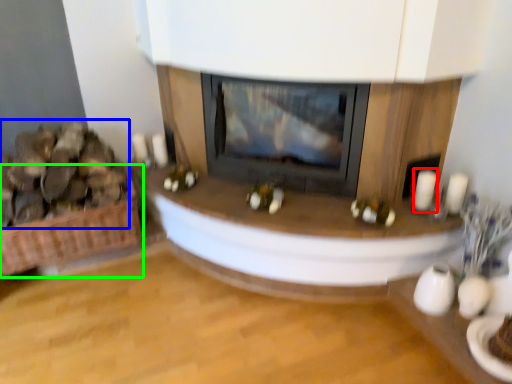
Question: Considering the real-world distances, which object is farthest from candle (highlighted by a red box)? food (highlighted by a blue box) or basket (highlighted by a green box)?

Choices:
 (A) food
 (B) basket

Answer: (A)